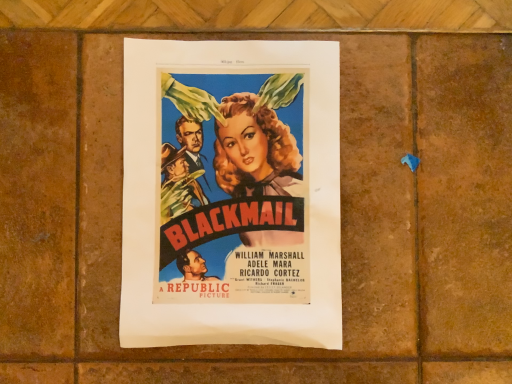
You are a GUI agent. You are given a task and a screenshot of the screen. Output one action in this format:
    pyautogui.click(x=<x>, y=<y>)
    Task: Click on the matte paper poster at center
    
    Given the screenshot: What is the action you would take?
    pyautogui.click(x=231, y=194)

Image resolution: width=512 pixels, height=384 pixels. What do you see at coordinates (231, 194) in the screenshot? I see `matte paper poster at center` at bounding box center [231, 194].

Where is `matte paper poster at center`? matte paper poster at center is located at coordinates (231, 194).